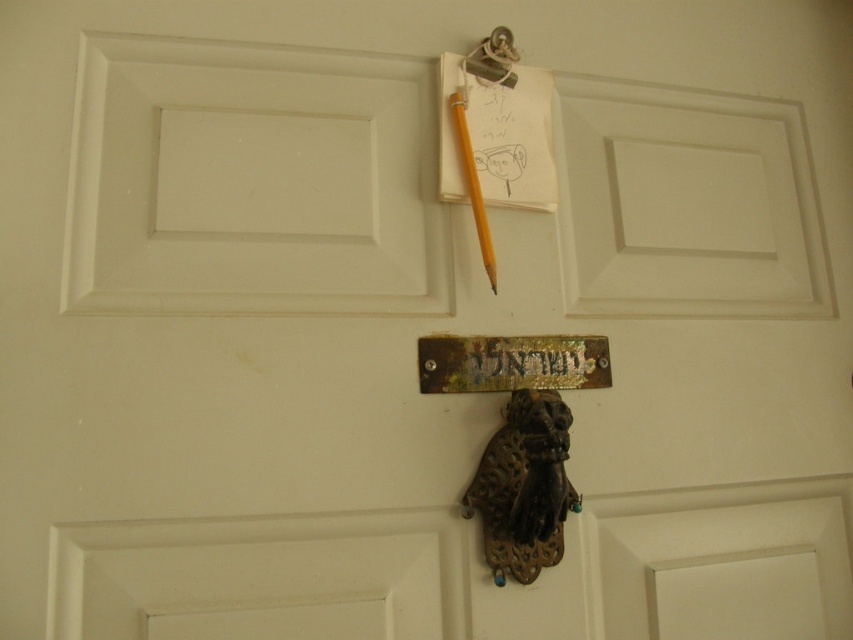
This screenshot has width=853, height=640. What do you see at coordinates (511, 362) in the screenshot?
I see `rusty metal sign at center` at bounding box center [511, 362].

Is rusty metal sign at center wider than metallic hook at upper center?

Yes.

Image resolution: width=853 pixels, height=640 pixels. Identify the location of rusty metal sign at center. (511, 362).

I want to click on rusty metal sign at center, so click(x=511, y=362).

Can you confirm if rusty metal sign at center is bigger than yellow wood pencil at center?

Indeed, rusty metal sign at center has a larger size compared to yellow wood pencil at center.

Which is above, rusty metal sign at center or yellow wood pencil at center?

Positioned higher is yellow wood pencil at center.

Is point (556, 384) positioned in front of point (473, 168)?

No.

This screenshot has height=640, width=853. Find the location of `rusty metal sign at center`. rusty metal sign at center is located at coordinates (511, 362).

Consider the image. Can you confirm if antique brass knocker at center is thinner than rusty metal sign at center?

Yes.

Does point (496, 524) come behind point (606, 360)?

No, it is in front of (606, 360).

Where is `antique brass knocker at center`? This screenshot has width=853, height=640. antique brass knocker at center is located at coordinates (523, 486).